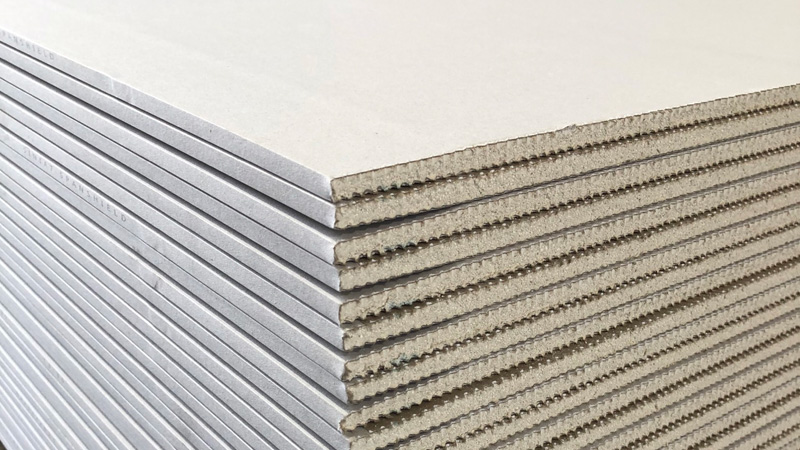
The width and height of the screenshot is (800, 450). Find the location of `top sheet (#1)`. top sheet (#1) is located at coordinates (174, 116).